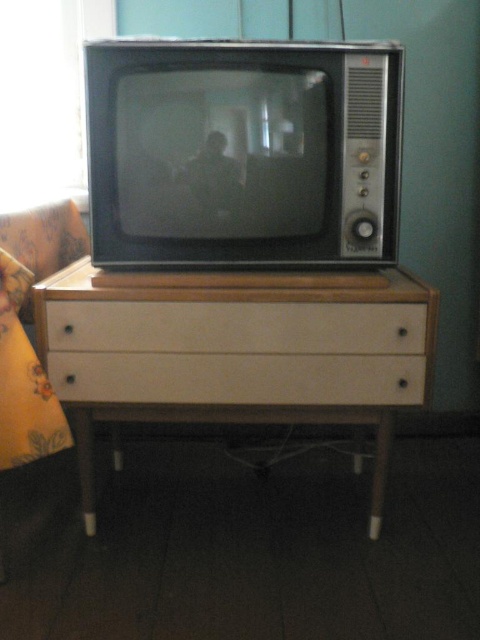
Does beige matte drawer at center appear over white matte drawer at center?

Indeed, beige matte drawer at center is positioned over white matte drawer at center.

In order to click on beige matte drawer at center in this screenshot , I will do `click(237, 326)`.

Is point (382, 458) behind point (120, 385)?

Yes.

Does white wood table at center have a lesser height compared to white matte drawer at center?

No, white wood table at center is not shorter than white matte drawer at center.

Between point (112, 396) and point (386, 396), which one is positioned in front?

Positioned in front is point (386, 396).

The width and height of the screenshot is (480, 640). Find the location of `white wood table at center`. white wood table at center is located at coordinates (235, 355).

Identify the location of white wood table at center. This screenshot has height=640, width=480. (235, 355).

Is the position of white wood table at center less distant than that of beige matte drawer at center?

Yes, white wood table at center is in front of beige matte drawer at center.

Image resolution: width=480 pixels, height=640 pixels. What do you see at coordinates (235, 355) in the screenshot?
I see `white wood table at center` at bounding box center [235, 355].

Where is `white wood table at center`? white wood table at center is located at coordinates (235, 355).